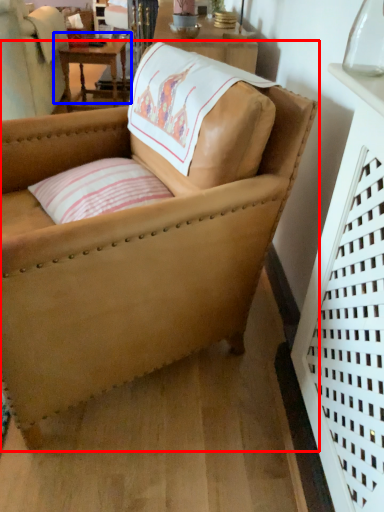
Question: Which of the following is the closest to the observer, chair (highlighted by a red box) or table (highlighted by a blue box)?

Choices:
 (A) chair
 (B) table

Answer: (A)